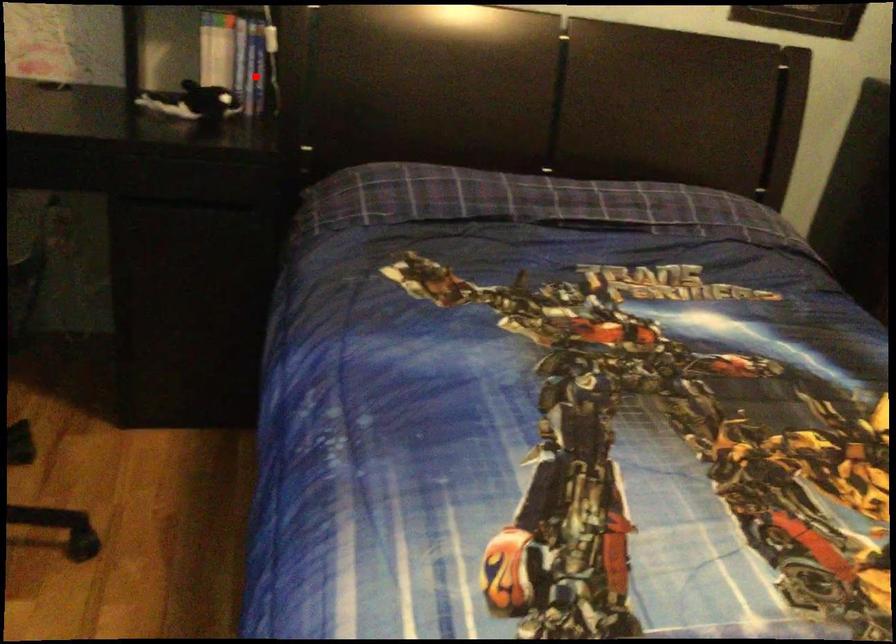
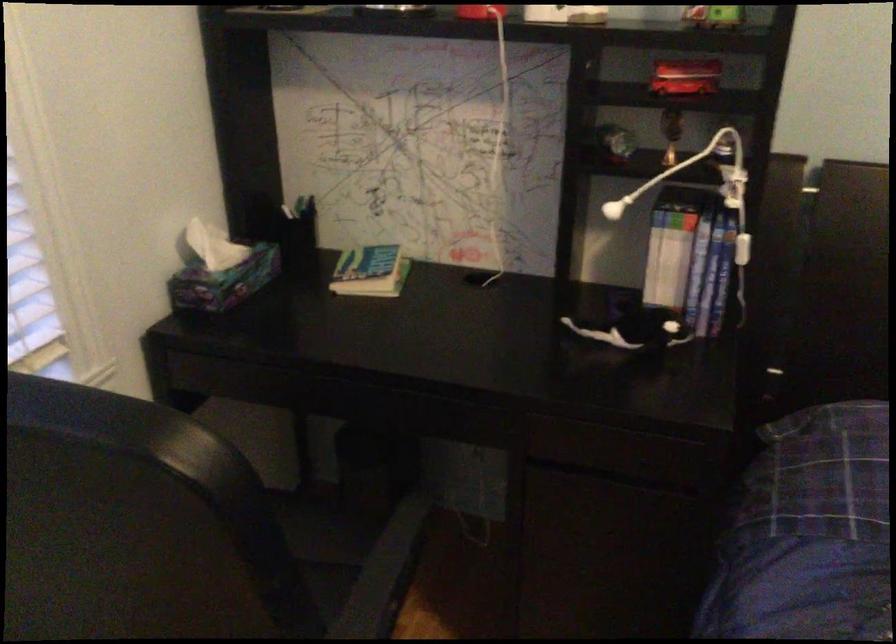
Question: I am providing you with two images of the same scene from different viewpoints. A red point is marked on the first image. Can you still see the location of the red point in image 2?

Choices:
 (A) Yes
 (B) No

Answer: (A)